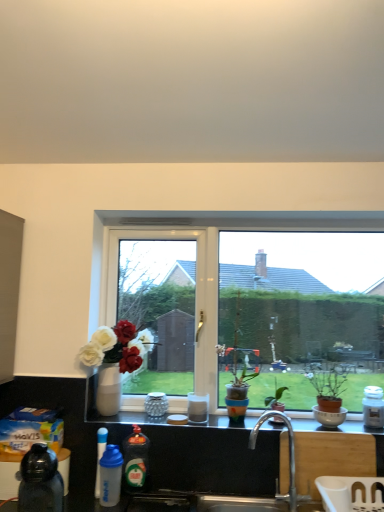
You are a GUI agent. You are given a task and a screenshot of the screen. Output one action in this format:
    pyautogui.click(x=<x>, y=<y>)
    Task: Click on the free region on the left part of green matte plant at center, the first houseplant positioned from the right
    The image size is (384, 512).
    Given the screenshot: What is the action you would take?
    pyautogui.click(x=242, y=425)